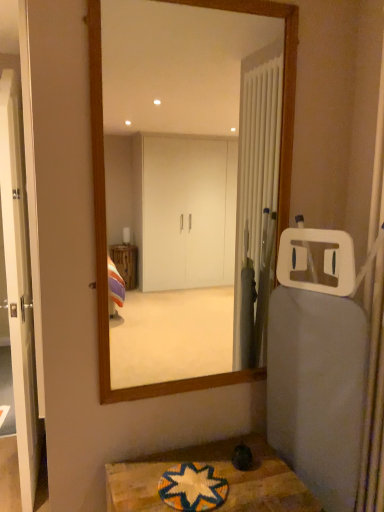
At what (x,y) coordinates should I click in order to perform the action: click on vacant region to the right of multicolored woven mat at lower center. Please return your answer as a coordinate pair (x, y). Looking at the image, I should click on (252, 488).